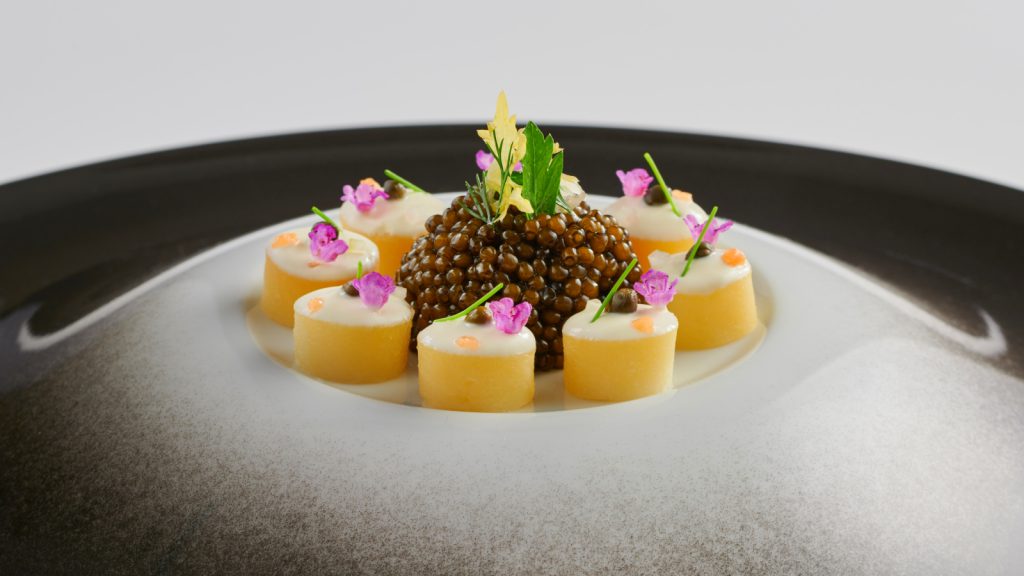
What are the coordinates of `white raised platform` in the screenshot? It's located at (668, 401).